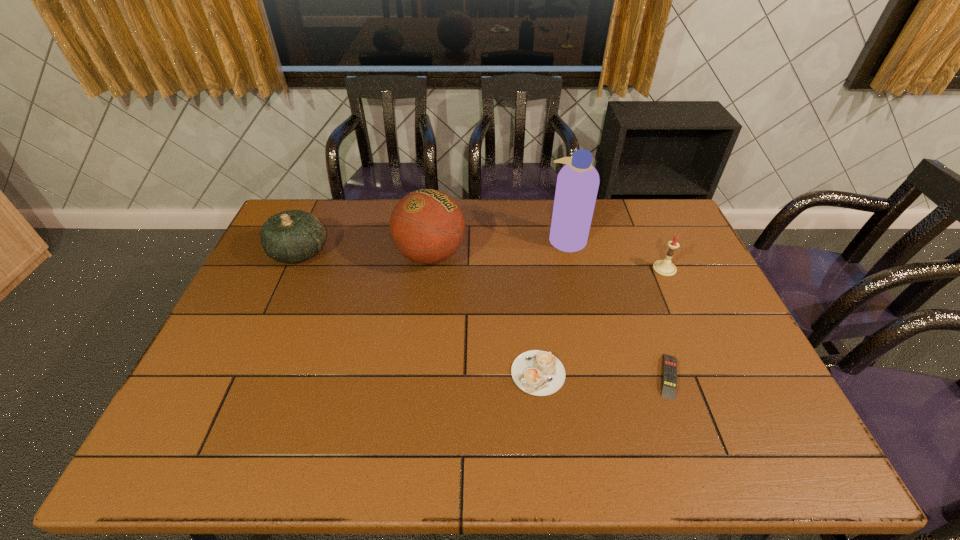
Where is `shampoo`? This screenshot has width=960, height=540. shampoo is located at coordinates (577, 185).

The height and width of the screenshot is (540, 960). In order to click on the third object from right to left in this screenshot , I will do `click(577, 185)`.

Where is `the second object from left to right`? The height and width of the screenshot is (540, 960). the second object from left to right is located at coordinates (427, 226).

This screenshot has width=960, height=540. Identify the location of the fifth shortest object. (427, 226).

The height and width of the screenshot is (540, 960). What are the coordinates of `gourd` in the screenshot? It's located at (293, 236).

Identify the location of the leftmost object. (293, 236).

Image resolution: width=960 pixels, height=540 pixels. I want to click on the rightmost object, so click(664, 267).

This screenshot has height=540, width=960. In order to click on the fourth tallest object in this screenshot , I will do `click(664, 267)`.

Where is `the fifth tallest object`? The image size is (960, 540). the fifth tallest object is located at coordinates click(536, 372).

You are a GUI agent. You are given a task and a screenshot of the screen. Output one action in this format:
    pyautogui.click(x=<x>, y=<y>)
    Task: Click on the cappuccino
    Image resolution: width=960 pixels, height=540 pixels.
    Given the screenshot: What is the action you would take?
    pyautogui.click(x=536, y=372)